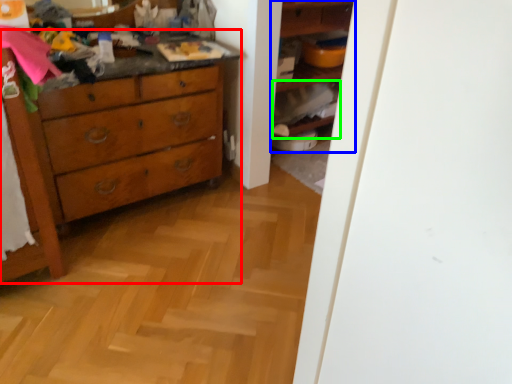
Question: Based on their relative distances, which object is nearer to chest of drawers (highlighted by a red box)? Choose from shelf (highlighted by a blue box) and cabinet (highlighted by a green box).

Choices:
 (A) shelf
 (B) cabinet

Answer: (B)